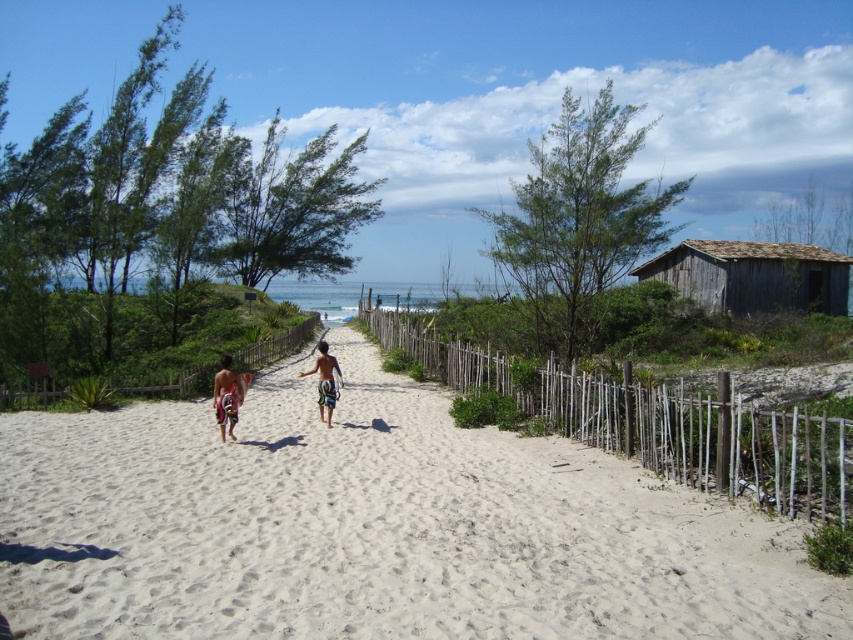
You are standing at the point closer to the camera. Which point are you at, point (784, 292) or point (231, 417)?

You are at point (784, 292) because it is further to the camera than point (231, 417).